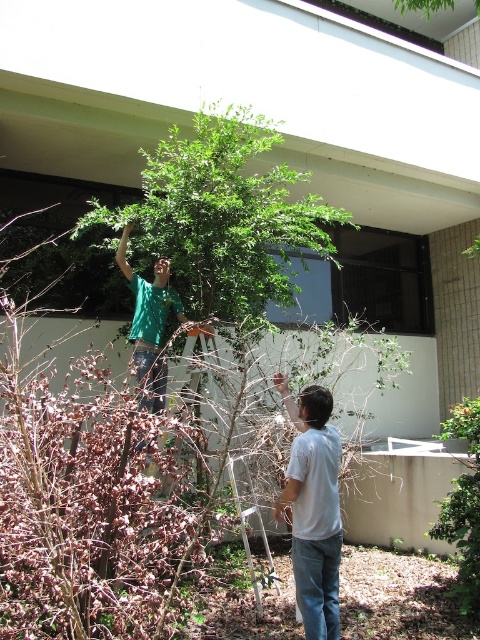
Between point (292, 524) and point (180, 380), which one is positioned in front?

Point (292, 524)

What do you see at coordinates (313, 508) in the screenshot? This screenshot has height=640, width=480. I see `white matte shirt at lower right` at bounding box center [313, 508].

Locate an element on the screen. white matte shirt at lower right is located at coordinates (313, 508).